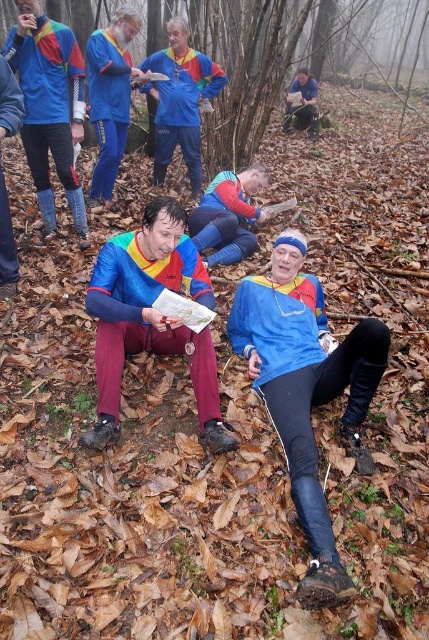
Is matte blue jacket at upper center smaller than matte blue jacket at upper left?

No.

Can you confirm if matte blue jacket at upper center is wider than matte blue jacket at upper left?

Yes, matte blue jacket at upper center is wider than matte blue jacket at upper left.

Where is `matte blue jacket at upper center`? The height and width of the screenshot is (640, 429). matte blue jacket at upper center is located at coordinates (180, 100).

The width and height of the screenshot is (429, 640). Find the location of `matte blue jacket at upper center`. matte blue jacket at upper center is located at coordinates (180, 100).

Is matte blue and red jacket at center to the left of blue fabric map at center from the viewer's perspective?

Correct, you'll find matte blue and red jacket at center to the left of blue fabric map at center.

Is matte blue and red jacket at center smaller than blue fabric map at center?

Indeed, matte blue and red jacket at center has a smaller size compared to blue fabric map at center.

Measure the distance between matte blue and red jacket at center and camera.

matte blue and red jacket at center and camera are 3.45 meters apart.

The image size is (429, 640). I want to click on matte blue and red jacket at center, so click(50, 106).

Is matte blue jacket at upper center shorter than matte blue jacket at center?

Incorrect, matte blue jacket at upper center's height does not fall short of matte blue jacket at center's.

Does matte blue jacket at upper center appear over matte blue jacket at center?

Correct, matte blue jacket at upper center is located above matte blue jacket at center.

The width and height of the screenshot is (429, 640). I want to click on matte blue jacket at upper center, so click(x=180, y=100).

The height and width of the screenshot is (640, 429). Find the location of `matte blue jacket at upper center`. matte blue jacket at upper center is located at coordinates (180, 100).